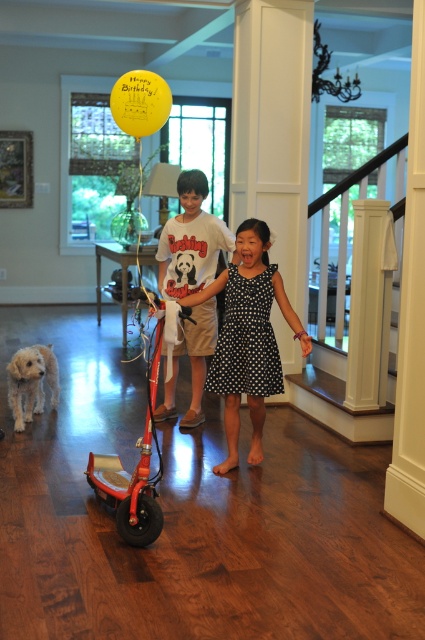
You are a photographer trying to capture the black dotted dress at center in the scene. Based on the coordinates provided, where should you focus your camera to ensure the dress is centered in your shot?

The black dotted dress at center is located at coordinates point (248,337), so you should focus your camera there to center it in the shot.

Consider the image. You are standing in the room and want to move from point [223,228] to point [141,83]. Which direction should you face to walk towards the second point?

To move from point [223,228] to point [141,83], you should face towards the left since point [141,83] is located to the left of point [223,228].